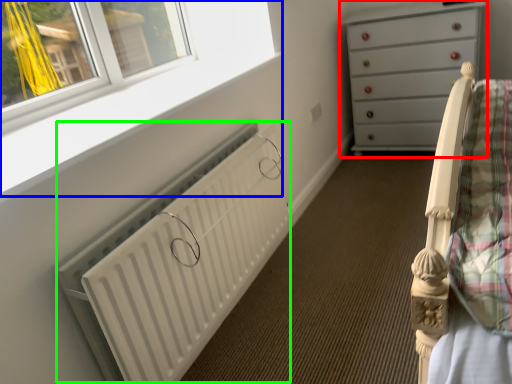
Question: Based on their relative distances, which object is nearer to chest of drawers (highlighted by a red box)? Choose from window frame (highlighted by a blue box) and radiator (highlighted by a green box).

Choices:
 (A) window frame
 (B) radiator

Answer: (A)